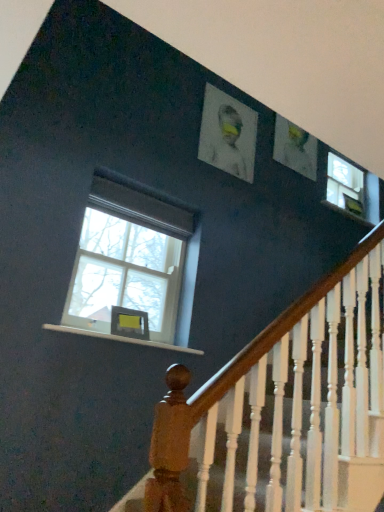
Question: Can you confirm if white matte portrait at upper center is thinner than white wood at lower left?

Choices:
 (A) no
 (B) yes

Answer: (B)

Question: Does white matte portrait at upper center have a larger size compared to white wood at lower left?

Choices:
 (A) no
 (B) yes

Answer: (B)

Question: Is white matte portrait at upper center located outside white wood at lower left?

Choices:
 (A) no
 (B) yes

Answer: (B)

Question: Does white matte portrait at upper center turn towards white wood at lower left?

Choices:
 (A) no
 (B) yes

Answer: (A)

Question: Is white matte portrait at upper center to the right of white wood at lower left from the viewer's perspective?

Choices:
 (A) yes
 (B) no

Answer: (A)

Question: In terms of width, does white wood at lower left look wider or thinner when compared to clear glass window at left?

Choices:
 (A) wide
 (B) thin

Answer: (A)

Question: In terms of size, does white wood at lower left appear bigger or smaller than clear glass window at left?

Choices:
 (A) small
 (B) big

Answer: (A)

Question: Is white wood at lower left inside the boundaries of clear glass window at left, or outside?

Choices:
 (A) outside
 (B) inside

Answer: (A)

Question: From the image's perspective, relative to clear glass window at left, is white wood at lower left above or below?

Choices:
 (A) above
 (B) below

Answer: (B)

Question: Visually, is white matte portrait at upper center positioned to the left or to the right of white wood at lower left?

Choices:
 (A) right
 (B) left

Answer: (A)

Question: In terms of size, does white matte portrait at upper center appear bigger or smaller than white wood at lower left?

Choices:
 (A) small
 (B) big

Answer: (B)

Question: From a real-world perspective, is white matte portrait at upper center positioned above or below white wood at lower left?

Choices:
 (A) above
 (B) below

Answer: (A)

Question: In terms of width, does white matte portrait at upper center look wider or thinner when compared to white wood at lower left?

Choices:
 (A) thin
 (B) wide

Answer: (A)

Question: Is point click(x=230, y=134) positioned closer to the camera than point click(x=129, y=189)?

Choices:
 (A) closer
 (B) farther

Answer: (B)

Question: From a real-world perspective, relative to clear glass window at left, is white matte portrait at upper center vertically above or below?

Choices:
 (A) above
 (B) below

Answer: (A)